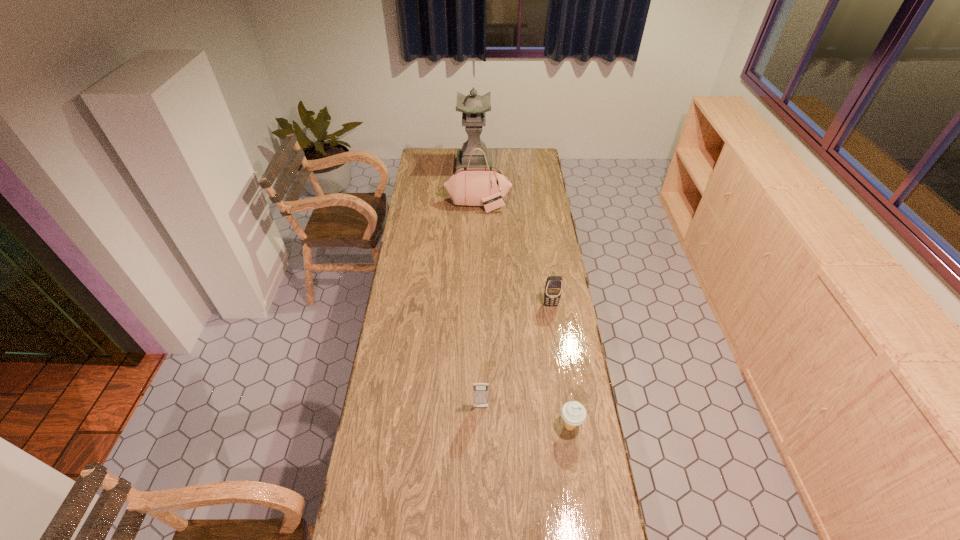
Locate an element on the screen. This screenshot has width=960, height=540. free region that satisfies the following two spatial constraints: 1. at the front opening of the nearest object; 2. on the right side of the tallest object is located at coordinates (470, 427).